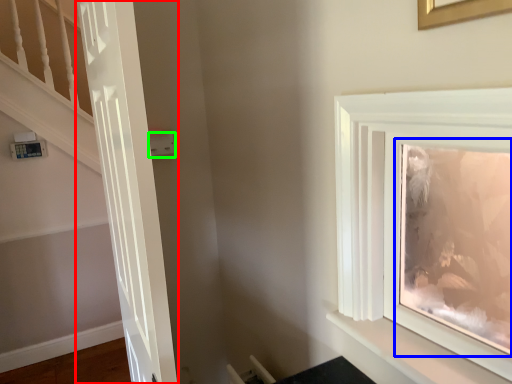
Question: Which object is positioned closest to door (highlighted by a red box)? Select from picture frame (highlighted by a blue box) and light switch (highlighted by a green box).

Choices:
 (A) picture frame
 (B) light switch

Answer: (B)